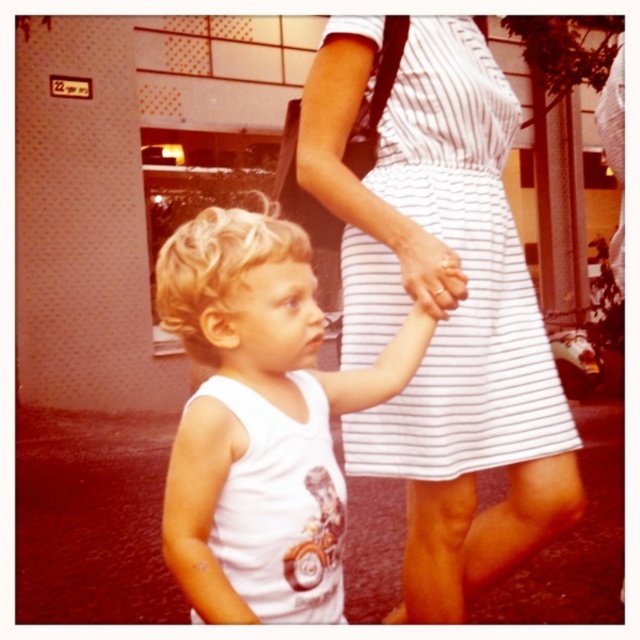
Question: Which point appears closest to the camera in this image?

Choices:
 (A) (422, 241)
 (B) (390, 308)
 (C) (257, 516)

Answer: (C)

Question: Based on their relative distances, which object is nearer to the white striped dress at center?

Choices:
 (A) white matte tank top at center
 (B) white matte hand at center

Answer: (B)

Question: Does white matte tank top at center come behind white matte hand at center?

Choices:
 (A) yes
 (B) no

Answer: (B)

Question: Based on their relative distances, which object is nearer to the white matte hand at center?

Choices:
 (A) white striped dress at center
 (B) white matte tank top at center

Answer: (A)

Question: In this image, where is white striped dress at center located relative to white matte tank top at center?

Choices:
 (A) right
 (B) left

Answer: (A)

Question: Can you confirm if white striped dress at center is thinner than white matte tank top at center?

Choices:
 (A) no
 (B) yes

Answer: (A)